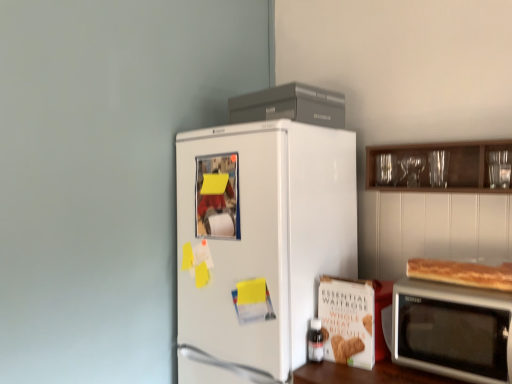
Question: Considering the positions of matte glass bottle at lower center and golden brown crusty bread at right in the image, is matte glass bottle at lower center bigger or smaller than golden brown crusty bread at right?

Choices:
 (A) big
 (B) small

Answer: (B)

Question: Considering their positions, is matte glass bottle at lower center located in front of or behind golden brown crusty bread at right?

Choices:
 (A) front
 (B) behind

Answer: (B)

Question: Considering the real-world distances, which object is closest to the matte glass bottle at lower center?

Choices:
 (A) transparent glassware at upper right
 (B) satin silver microwave at lower right
 (C) golden brown crusty bread at right
 (D) white matte refrigerator at center

Answer: (D)

Question: Which object is the farthest from the golden brown crusty bread at right?

Choices:
 (A) satin silver microwave at lower right
 (B) matte glass bottle at lower center
 (C) transparent glassware at upper right
 (D) white matte refrigerator at center

Answer: (D)